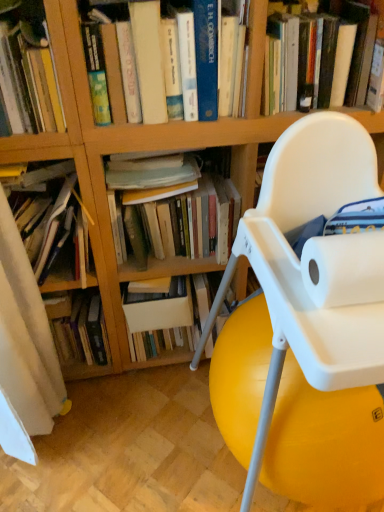
Question: Is hardcover book at upper center, the sixth book from the left, spatially inside hardcover book at upper left, which is the 3th book in left-to-right order, or outside of it?

Choices:
 (A) inside
 (B) outside

Answer: (B)

Question: Is hardcover book at upper center, the sixth book from the left, taller or shorter than hardcover book at upper left, the 4th book from the right?

Choices:
 (A) tall
 (B) short

Answer: (A)

Question: Which object is positioned farthest from the hardcover book at left, which appears as the 5th book when viewed from the right?

Choices:
 (A) hardcover books at center, marked as the 5th book in a left-to-right arrangement
 (B) hardcover book at upper center, which is counted as the fourth book, starting from the left
 (C) hardcover book at upper center, the sixth book from the left
 (D) hardcover books at left, placed as the 6th book when sorted from right to left
 (E) hardcover book at upper left, the 4th book from the right

Answer: (C)

Question: Considering the real-world distances, which object is farthest from the hardcover book at upper center, the sixth book from the left?

Choices:
 (A) white plastic chair at center
 (B) hardcover books at left, the 1th book positioned from the left
 (C) hardcover books at center, acting as the 2th book starting from the right
 (D) hardcover book at left, which appears as the 5th book when viewed from the right
 (E) hardcover book at upper left, the 4th book from the right

Answer: (D)